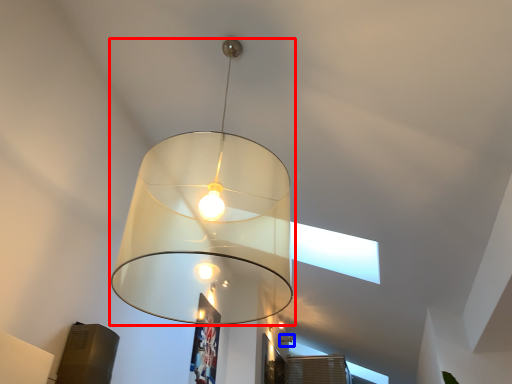
Question: Which object appears farthest to the camera in this image, lamp (highlighted by a red box) or lamp (highlighted by a blue box)?

Choices:
 (A) lamp
 (B) lamp

Answer: (B)